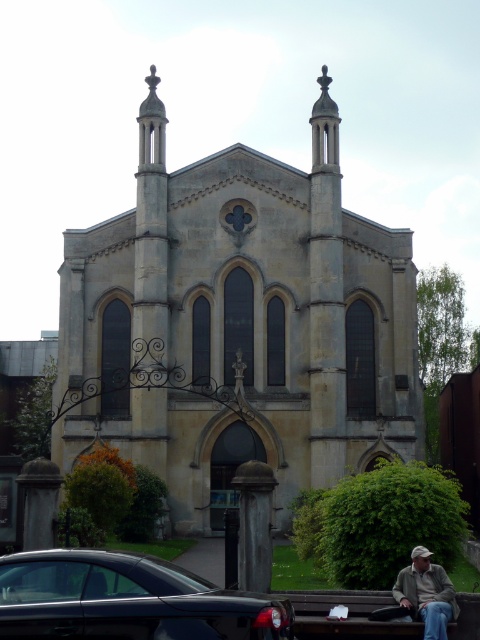
You are standing at the entrance of the historic building and want to park your car. Where is the shiny black car at lower left located relative to the building?

The shiny black car at lower left is located at point (126, 600) relative to the building.

You are standing in a park and see a historic building with Gothic features. You want to take a photo of the light beige stone church at center. Where should you position yourself to capture the church in the center of your photo?

Position yourself directly in front of the light beige stone church at center at point coordinates approximately 0.509 on the x axis and 0.498 on the y axis to center it in your photo.

You are a photographer planning to capture the light beige stone church at center and the shiny black car at lower left in a single frame. Considering their sizes, which object should you focus on to ensure both are visible without cropping?

The light beige stone church at center is much taller than the shiny black car at lower left, so to include both in the frame without cropping, focus on positioning the camera to capture the full height of the church while ensuring the car remains within the shot.